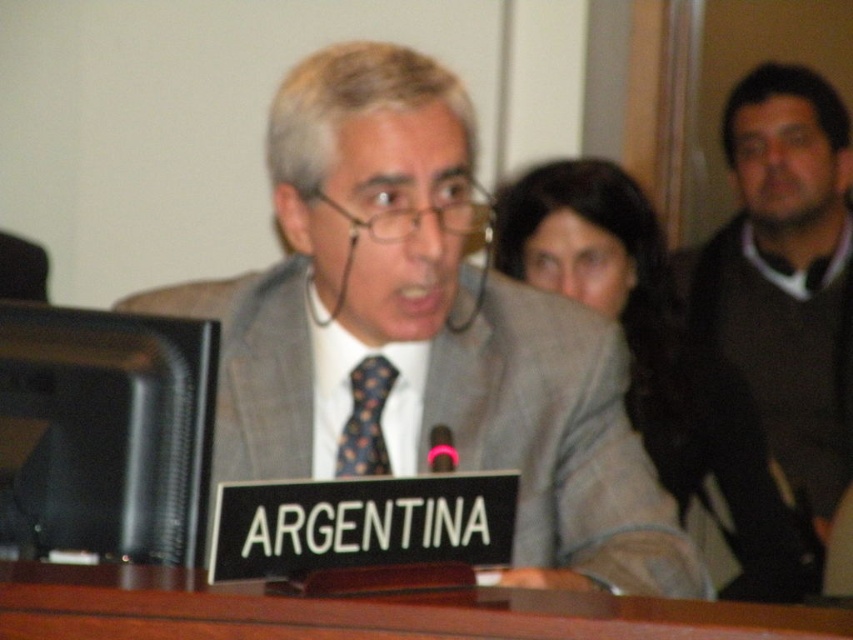
Question: Is dark gray suit at center to the right of brown wooden table at center from the viewer's perspective?

Choices:
 (A) no
 (B) yes

Answer: (B)

Question: Which is nearer to the dark gray sweater at right?

Choices:
 (A) dark gray suit at center
 (B) gray suit at center
 (C) brown wooden table at center

Answer: (A)

Question: Which object is the farthest from the polka dot silk tie at center?

Choices:
 (A) dark gray sweater at right
 (B) dark gray suit at center
 (C) brown wooden table at center

Answer: (A)

Question: Estimate the real-world distances between objects in this image. Which object is closer to the dark gray sweater at right?

Choices:
 (A) brown wooden table at center
 (B) black glossy monitor at left
 (C) gray suit at center

Answer: (C)

Question: Is dark gray suit at center to the left of brown wooden table at center from the viewer's perspective?

Choices:
 (A) no
 (B) yes

Answer: (A)

Question: Observing the image, what is the correct spatial positioning of brown wooden table at center in reference to polka dot silk tie at center?

Choices:
 (A) right
 (B) left

Answer: (A)